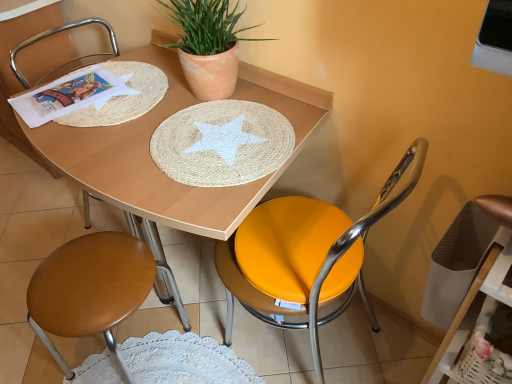
The width and height of the screenshot is (512, 384). Identify the location of free space to the left of brown leather stool at lower left, which is counted as the 3th chair, starting from the right. (55, 226).